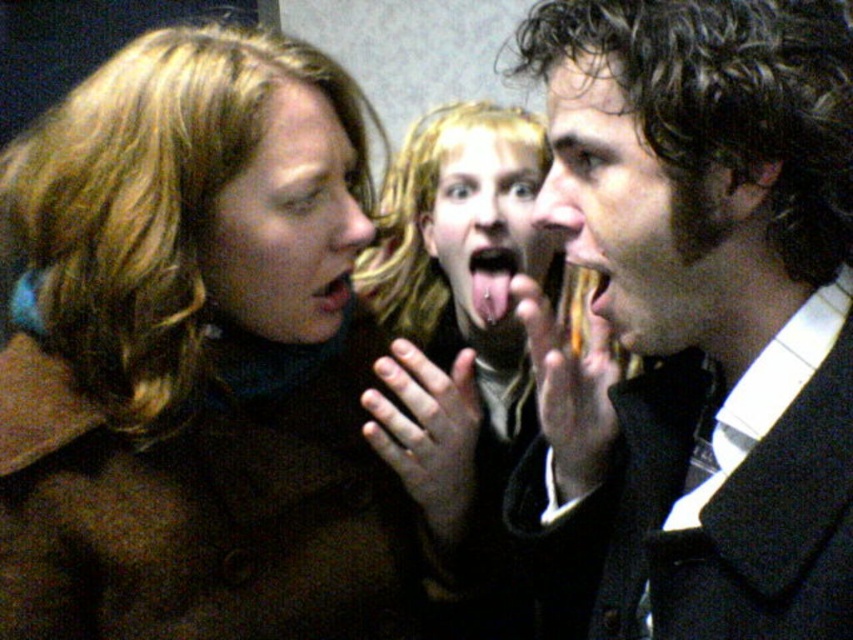
Which is above, curly hair at center or pink glossy tongue at center?

Positioned higher is curly hair at center.

Does curly hair at center have a smaller size compared to pink glossy tongue at center?

Incorrect, curly hair at center is not smaller in size than pink glossy tongue at center.

At what (x,y) coordinates should I click in order to perform the action: click on curly hair at center. Please return your answer as a coordinate pair (x, y). Looking at the image, I should click on (631, 214).

The image size is (853, 640). In order to click on curly hair at center in this screenshot , I will do `click(631, 214)`.

At what (x,y) coordinates should I click in order to perform the action: click on smooth blonde hair at center. Please return your answer as a coordinate pair (x, y). Looking at the image, I should click on (467, 314).

Consider the image. Is smooth blonde hair at center wider than matte brown hair at center?

Indeed, smooth blonde hair at center has a greater width compared to matte brown hair at center.

Measure the distance between point (383,196) and camera.

They are 1.59 meters apart.

Locate an element on the screen. The height and width of the screenshot is (640, 853). smooth blonde hair at center is located at coordinates (467, 314).

Can you confirm if smooth blonde hair at center is positioned below curly hair at center?

Incorrect, smooth blonde hair at center is not positioned below curly hair at center.

Which is in front, point (386, 202) or point (668, 284)?

Point (668, 284)

Between point (387, 312) and point (576, 256), which one is positioned in front?

Point (576, 256)

Locate an element on the screen. The height and width of the screenshot is (640, 853). smooth blonde hair at center is located at coordinates (467, 314).